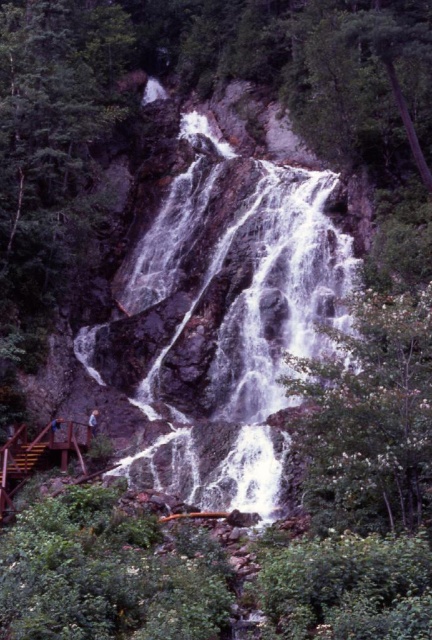
Question: Which object is positioned farthest from the white frothy water at center?

Choices:
 (A) green leafy tree at center
 (B) brown wooden stairs at lower left

Answer: (B)

Question: Which point is closer to the camera taking this photo?

Choices:
 (A) (298, 209)
 (B) (25, 468)
 (C) (324, 476)

Answer: (C)

Question: In this image, where is white frothy water at center located relative to green leafy tree at center?

Choices:
 (A) left
 (B) right

Answer: (A)

Question: Can you confirm if white frothy water at center is positioned to the left of green leafy tree at center?

Choices:
 (A) no
 (B) yes

Answer: (B)

Question: Which object is closer to the camera taking this photo?

Choices:
 (A) white frothy water at center
 (B) green leafy tree at center
 (C) brown wooden stairs at lower left

Answer: (B)

Question: In this image, where is green leafy tree at center located relative to brown wooden stairs at lower left?

Choices:
 (A) above
 (B) below

Answer: (A)